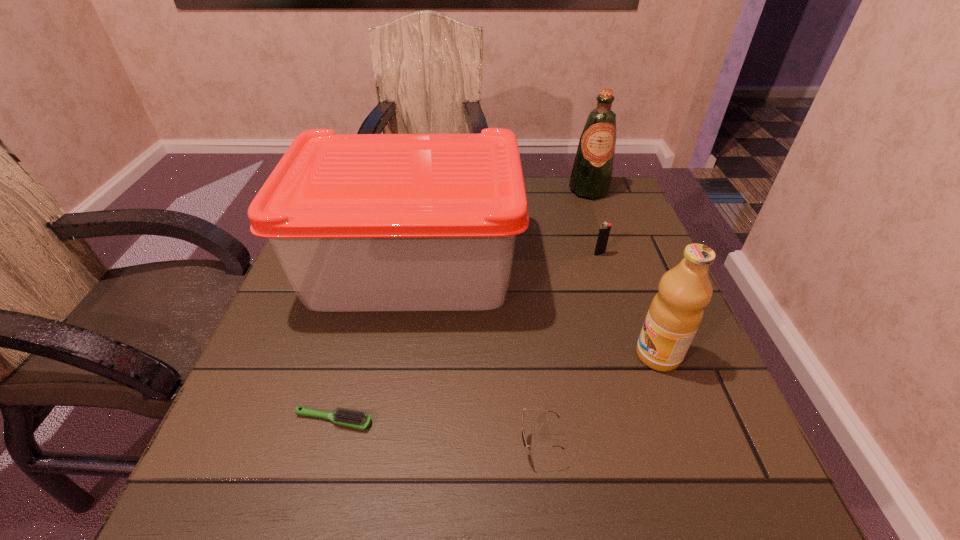
Image resolution: width=960 pixels, height=540 pixels. I want to click on hairbrush present at the left edge, so click(355, 419).

The width and height of the screenshot is (960, 540). In order to click on igniter that is at the right edge in this screenshot , I will do `click(604, 231)`.

Identify the location of object present at the far left corner. This screenshot has width=960, height=540. (359, 222).

Identify the location of object present at the far right corner. The height and width of the screenshot is (540, 960). (591, 176).

In the image, there is a desktop. Identify the location of free space at the far edge. The image size is (960, 540). (554, 176).

Where is `vacant space at the near edge of the desktop`? This screenshot has width=960, height=540. vacant space at the near edge of the desktop is located at coordinates (444, 487).

Locate an element on the screen. free space at the left edge of the desktop is located at coordinates (303, 314).

Where is `vacant space at the right edge of the desktop`? The height and width of the screenshot is (540, 960). vacant space at the right edge of the desktop is located at coordinates (607, 300).

Where is `blank region between the igniter and the nearer olive oil`? Image resolution: width=960 pixels, height=540 pixels. blank region between the igniter and the nearer olive oil is located at coordinates (629, 305).

Locate an element on the screen. The height and width of the screenshot is (540, 960). vacant region between the hairbrush and the tray is located at coordinates (372, 343).